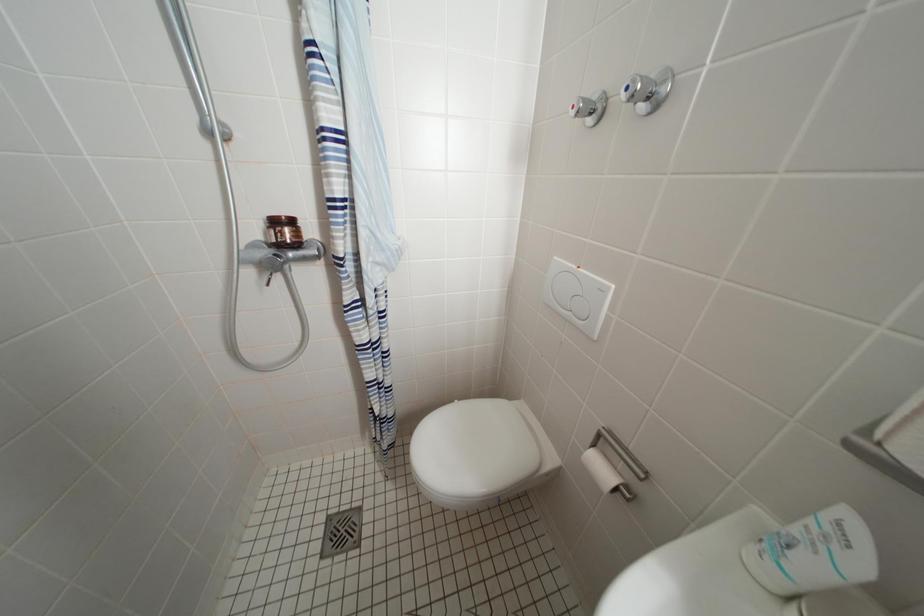
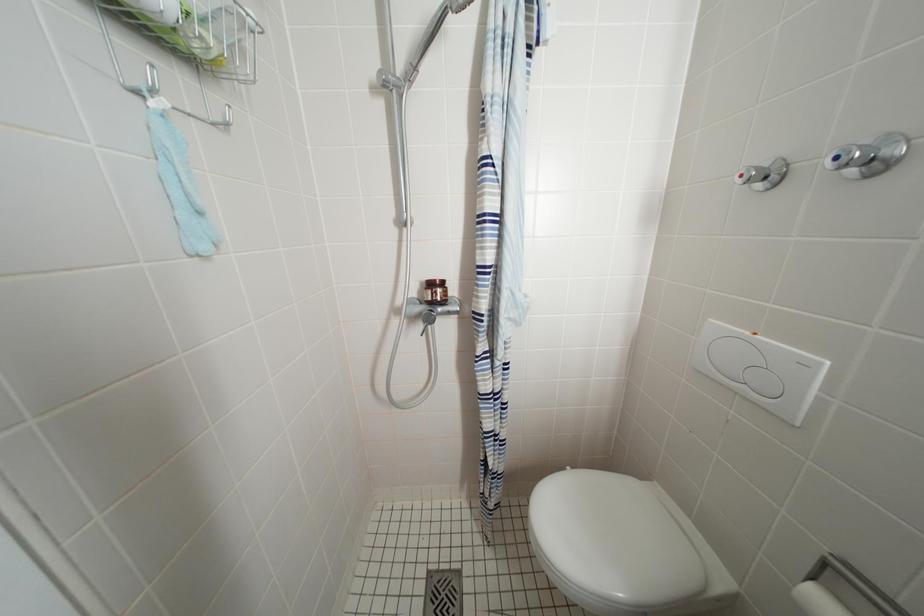
From the picture: The images are taken continuously from a first-person perspective. In which direction are you moving?

The cameraman moved toward left, backward.